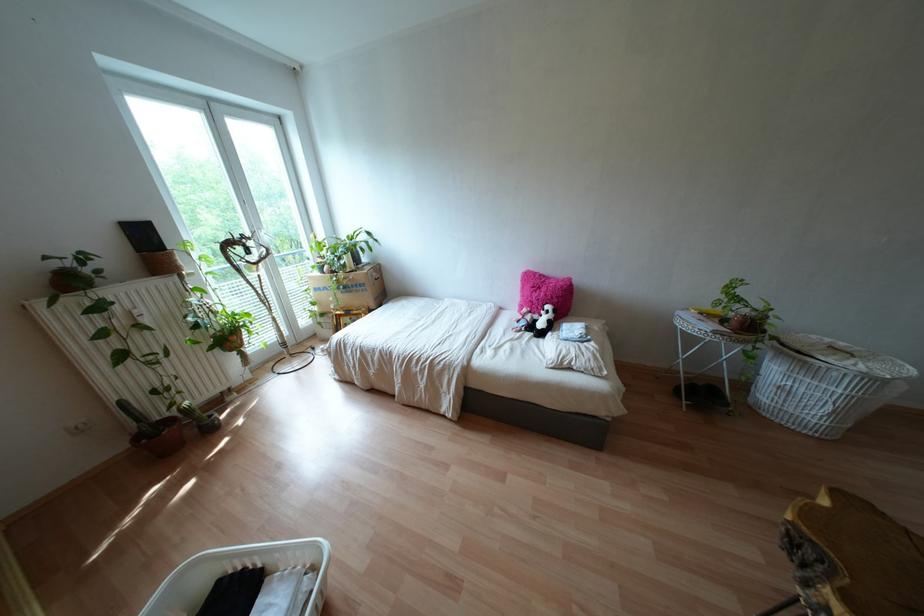
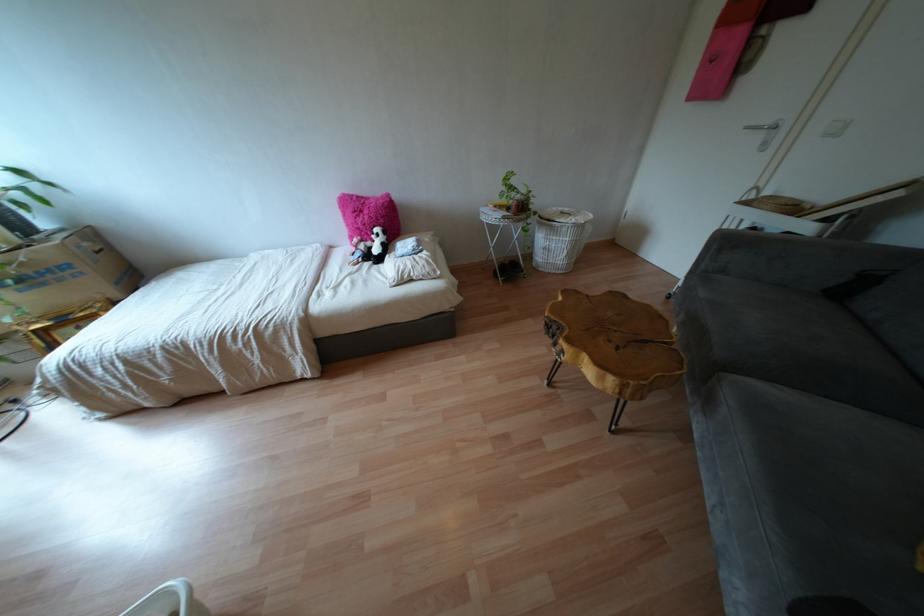
The point at (831, 408) is marked in the first image. Where is the corresponding point in the second image?

(565, 252)